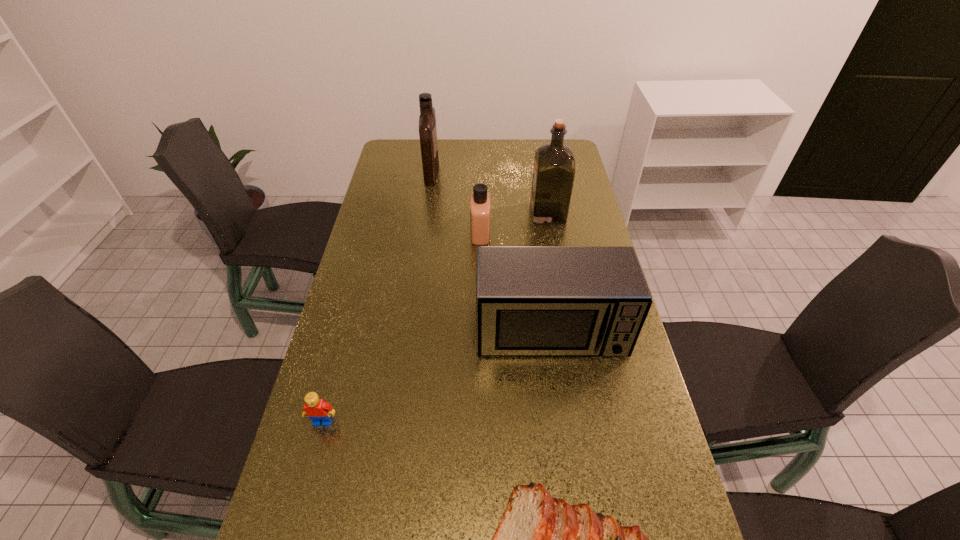
Locate an element on the screen. vacant space located on the label of the right liquor is located at coordinates (427, 213).

Find the location of a particular element. The width and height of the screenshot is (960, 540). vacant region located on the label side of the fifth object from right to left is located at coordinates (495, 172).

At what (x,y) coordinates should I click in order to perform the action: click on free region located 0.240m on the front-facing side of the fourth shortest object. Please return your answer as a coordinate pair (x, y). This screenshot has height=540, width=960. Looking at the image, I should click on (567, 451).

Where is `free space located on the front label of the perfume`? free space located on the front label of the perfume is located at coordinates (379, 232).

Where is `free space located 0.370m on the front label of the perfume`? free space located 0.370m on the front label of the perfume is located at coordinates (365, 232).

This screenshot has width=960, height=540. I want to click on vacant space located on the front label of the perfume, so click(x=393, y=232).

Find the location of a particular element. The width and height of the screenshot is (960, 540). vacant area located 0.060m on the face of the Lego is located at coordinates (315, 453).

Locate an element on the screen. object present at the far edge is located at coordinates (427, 120).

I want to click on object that is at the left edge, so click(317, 410).

Identify the location of liquor at the right edge. (554, 163).